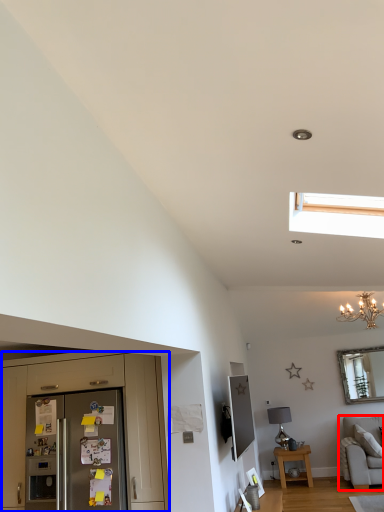
Question: Which object is further to the camera taking this photo, studio couch (highlighted by a red box) or cabinetry (highlighted by a blue box)?

Choices:
 (A) studio couch
 (B) cabinetry

Answer: (A)